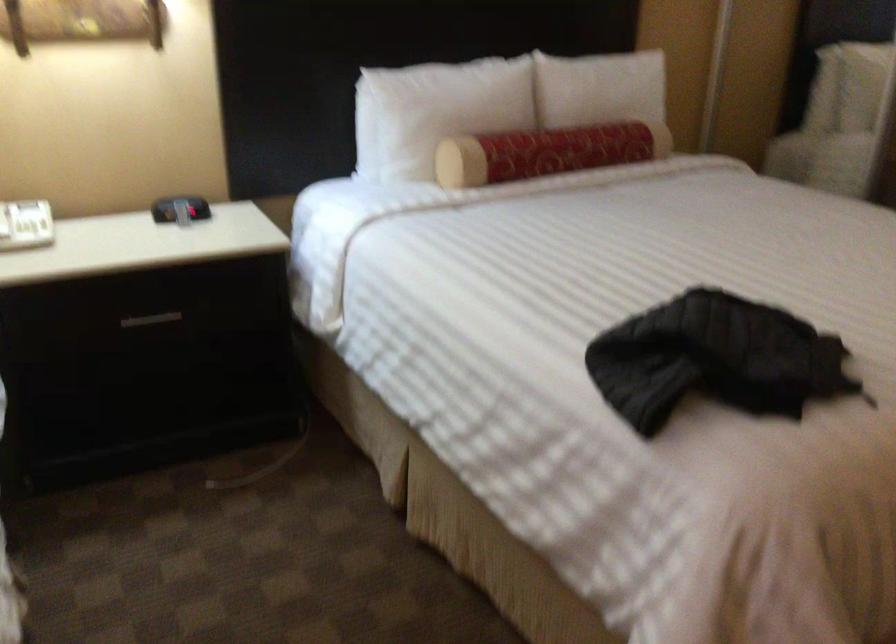
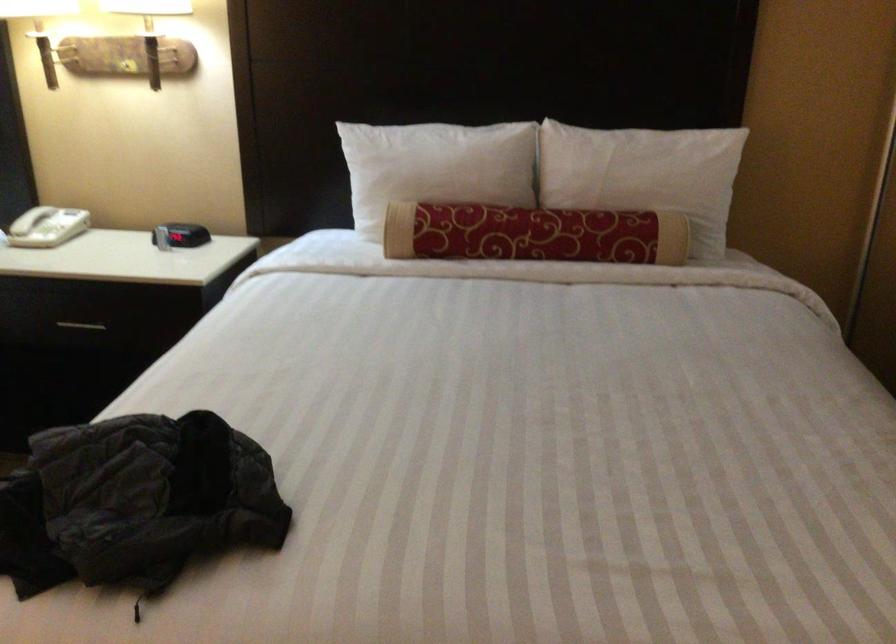
Where in the second image is the point corresponding to point 581,147 from the first image?

(533, 234)